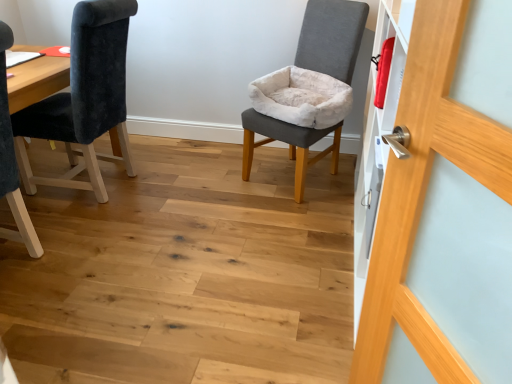
Question: Is velvet dark blue chair at left, the 2th chair viewed from the right, inside or outside of wooden door handle at right?

Choices:
 (A) outside
 (B) inside

Answer: (A)

Question: Does point 49,135 appear closer or farther from the camera than point 359,329?

Choices:
 (A) closer
 (B) farther

Answer: (B)

Question: Estimate the real-world distances between objects in this image. Which object is closer to the gray fabric chair at center, the 1th chair viewed from the right?

Choices:
 (A) wooden door handle at right
 (B) velvet dark blue chair at left, which is the 1th chair in left-to-right order

Answer: (B)

Question: Which of these objects is positioned closest to the gray fabric chair at center, the 1th chair viewed from the right?

Choices:
 (A) wooden door handle at right
 (B) velvet dark blue chair at left, which is the 1th chair in left-to-right order

Answer: (B)